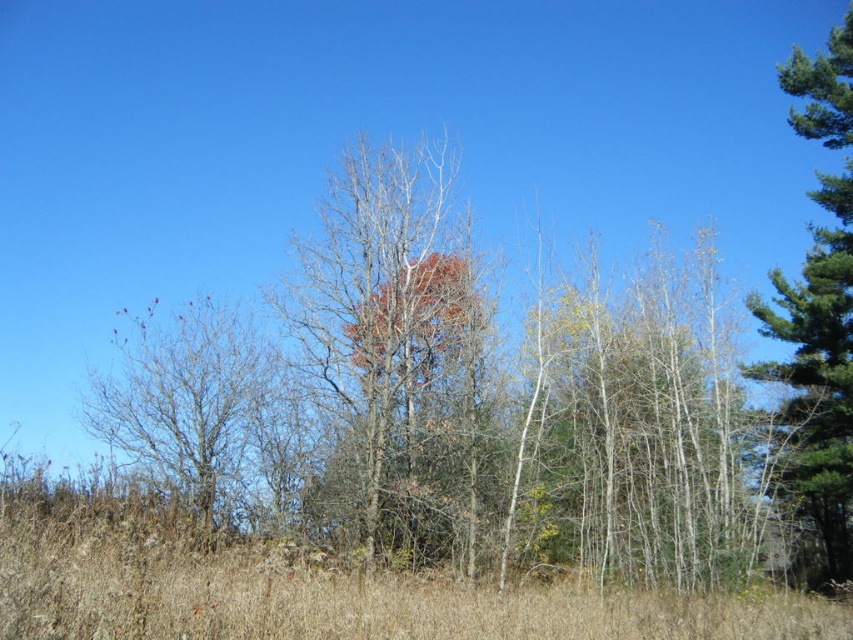
You are standing in the field with dry grass and looking at the scene. Where exactly are the bare branches at center located?

The bare branches at center are located at point 0.637 on the x axis and 0.543 on the y axis.